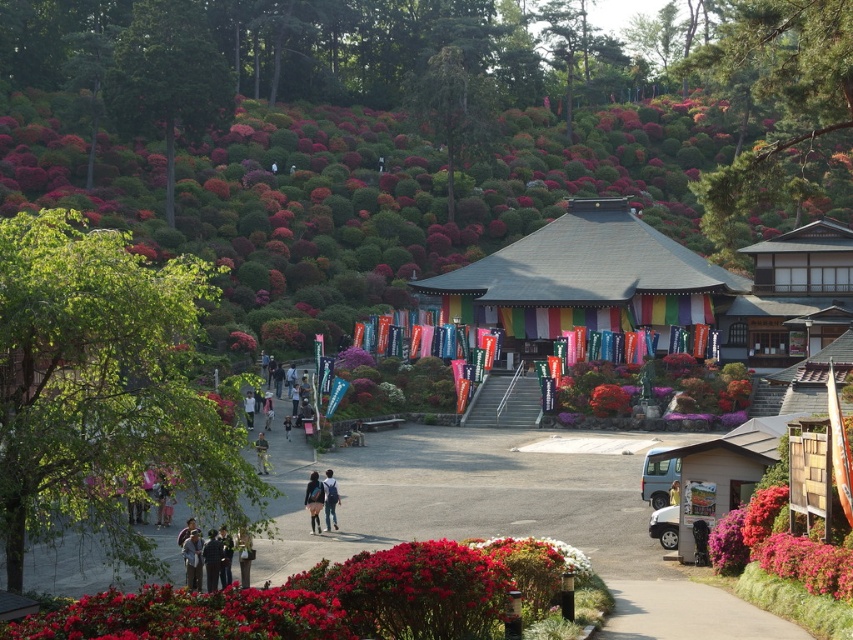
Question: Does green leafy tree at upper left appear on the right side of denim jacket at lower center?

Choices:
 (A) yes
 (B) no

Answer: (B)

Question: Which is nearer to the denim jacket at lower left?

Choices:
 (A) yellow fabric person at center
 (B) green leafy tree at left

Answer: (B)

Question: Estimate the real-world distances between objects in this image. Which object is closer to the light brown leather jacket at lower center?

Choices:
 (A) green leafy tree at upper left
 (B) glossy red bush at lower center
 (C) vivid red petals at center
 (D) denim jacket at lower center

Answer: (D)

Question: Estimate the real-world distances between objects in this image. Which object is farther from the yellow fabric person at center?

Choices:
 (A) denim jacket at lower center
 (B) denim pants at center

Answer: (A)

Question: Does green leafy tree at left have a greater width compared to yellow fabric person at center?

Choices:
 (A) no
 (B) yes

Answer: (B)

Question: Is green leafy tree at left further to the viewer compared to denim jacket at lower left?

Choices:
 (A) no
 (B) yes

Answer: (A)